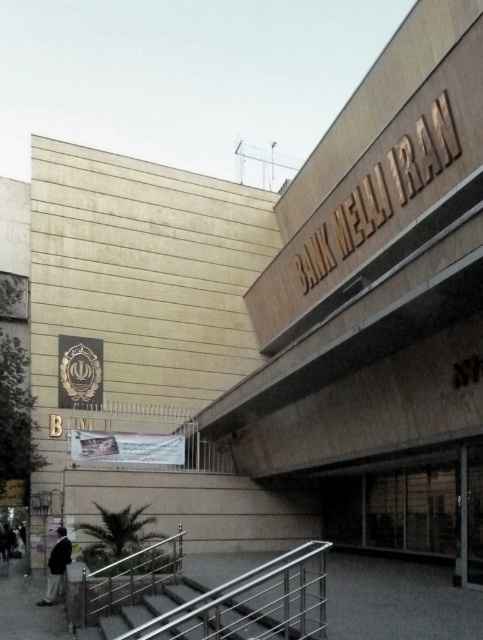
Question: Is glass door at center in front of dark gray suit at lower left?

Choices:
 (A) yes
 (B) no

Answer: (A)

Question: Which object appears farthest from the camera in this image?

Choices:
 (A) stainless steel stairs at center
 (B) dark gray suit at lower left

Answer: (B)

Question: Is stainless steel stairs at center wider than dark gray suit at lower left?

Choices:
 (A) no
 (B) yes

Answer: (B)

Question: Which point is closer to the camera?

Choices:
 (A) dark gray suit at lower left
 (B) stainless steel stairs at center
 (C) glass door at center

Answer: (B)

Question: Which object is closer to the camera taking this photo?

Choices:
 (A) stainless steel stairs at center
 (B) glass door at center

Answer: (A)

Question: Can you confirm if glass door at center is positioned to the left of dark gray suit at lower left?

Choices:
 (A) no
 (B) yes

Answer: (A)